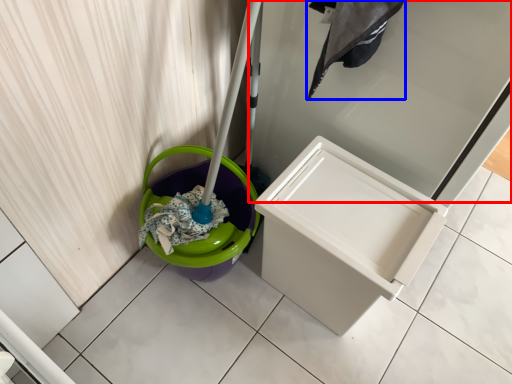
Question: Which point is closer to the camera, screen door (highlighted by a red box) or laundry (highlighted by a blue box)?

Choices:
 (A) screen door
 (B) laundry

Answer: (A)